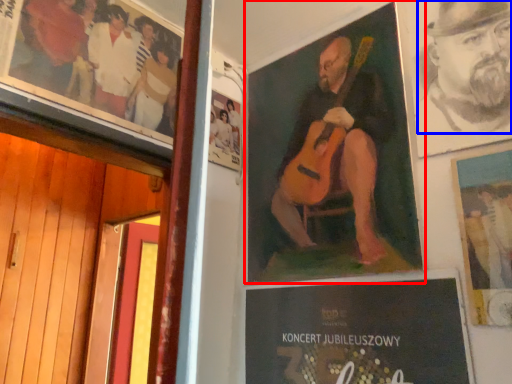
Question: Among these objects, which one is nearest to the camera, poster (highlighted by a red box) or person (highlighted by a blue box)?

Choices:
 (A) poster
 (B) person

Answer: (B)